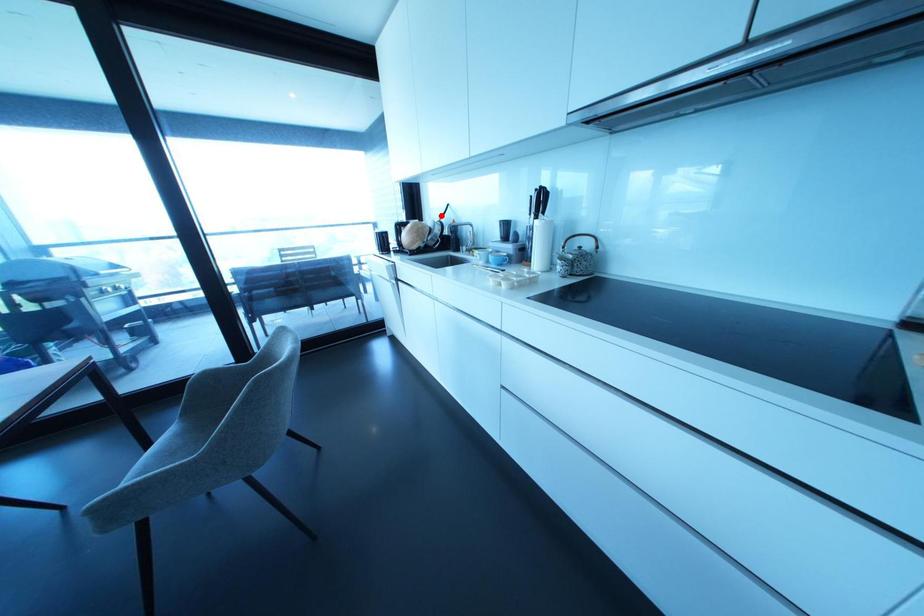
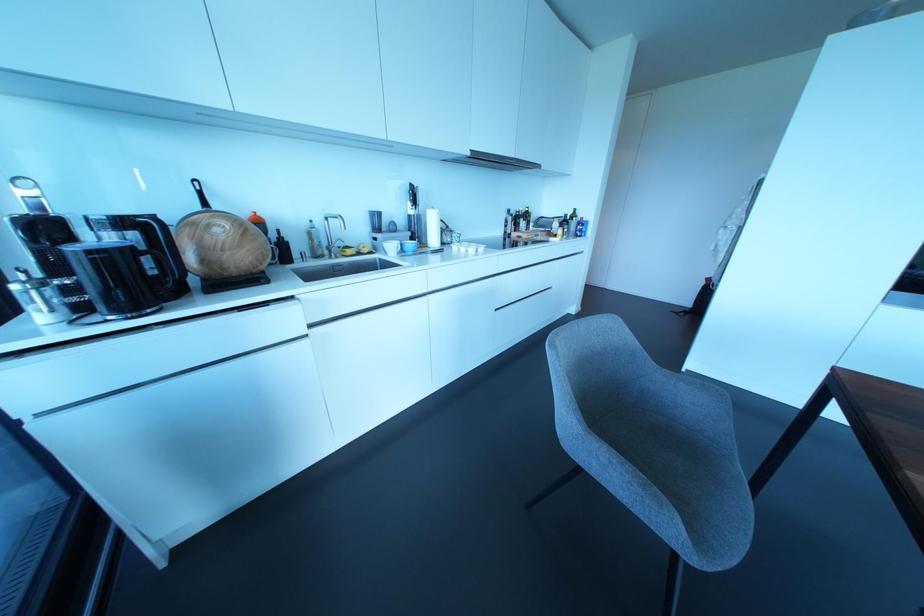
Where in the second image is the point corresponding to the highlighted location from the first image?

(204, 204)